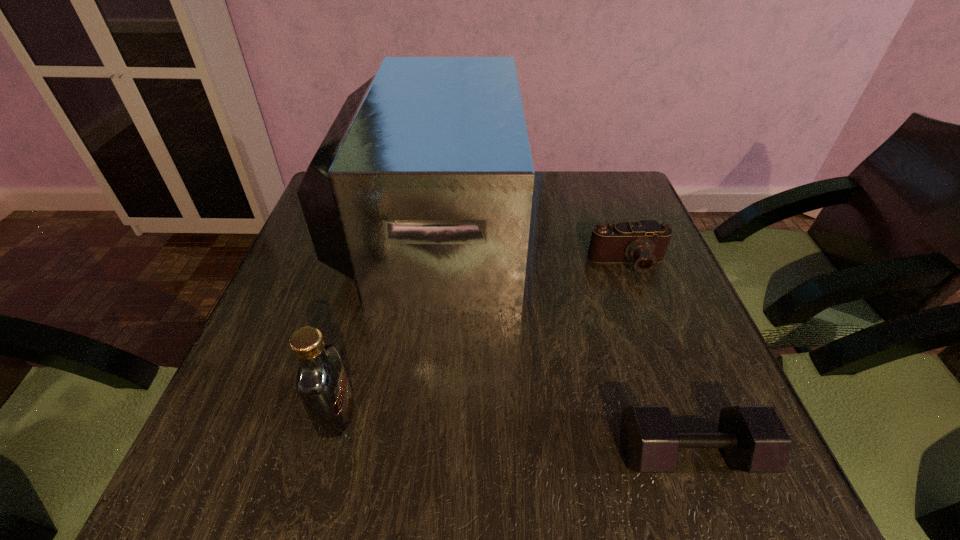
The width and height of the screenshot is (960, 540). In order to click on vacant space that's between the dumbbell and the second tallest object in this screenshot , I will do (513, 434).

The width and height of the screenshot is (960, 540). What are the coordinates of `free spot between the dumbbell and the camera` in the screenshot? It's located at (659, 359).

In order to click on free space between the microwave oven and the dumbbell in this screenshot , I will do `click(561, 341)`.

The image size is (960, 540). In order to click on free spot between the dumbbell and the microwave oven in this screenshot , I will do `click(561, 341)`.

Find the location of a particular element. free spot between the microwave oven and the camera is located at coordinates (530, 246).

Image resolution: width=960 pixels, height=540 pixels. Identify the location of vacant space that's between the vodka and the dumbbell. (513, 434).

The height and width of the screenshot is (540, 960). Identify the location of free space that is in between the dumbbell and the second tallest object. (513, 434).

In order to click on empty location between the camera and the vodka in this screenshot , I will do `click(482, 339)`.

Image resolution: width=960 pixels, height=540 pixels. Find the location of `blank region between the dumbbell and the third shortest object`. blank region between the dumbbell and the third shortest object is located at coordinates (513, 434).

The image size is (960, 540). What are the coordinates of `empty space that is in between the tallest object and the second tallest object` in the screenshot? It's located at (384, 321).